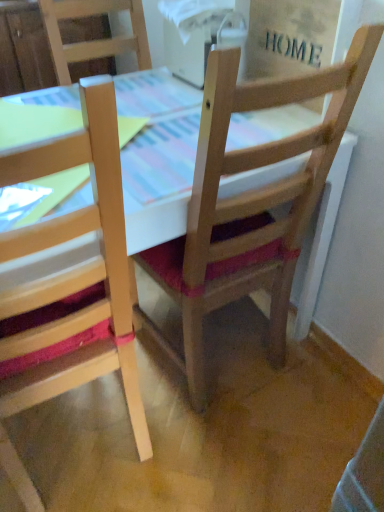
Question: Is wooden table at center to the left or to the right of natural wood chair at left, the second chair viewed from the right, in the image?

Choices:
 (A) left
 (B) right

Answer: (B)

Question: Looking at the image, does wooden table at center seem bigger or smaller compared to natural wood chair at left, the second chair viewed from the right?

Choices:
 (A) big
 (B) small

Answer: (A)

Question: Which object is positioned closest to the natural wood chair at left, placed as the first chair when sorted from left to right?

Choices:
 (A) wooden chair at center, which is the 1th chair in right-to-left order
 (B) wooden table at center

Answer: (A)

Question: Estimate the real-world distances between objects in this image. Which object is farther from the wooden chair at center, acting as the 2th chair starting from the left?

Choices:
 (A) wooden table at center
 (B) natural wood chair at left, placed as the first chair when sorted from left to right

Answer: (B)